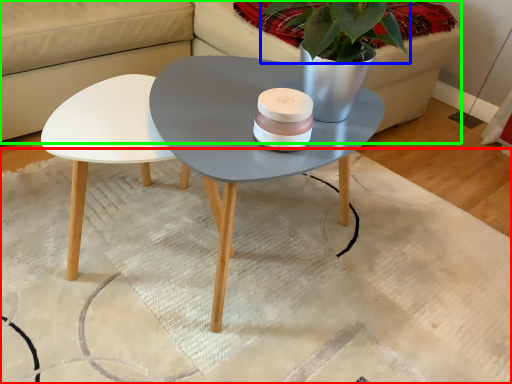
Question: Estimate the real-world distances between objects in this image. Which object is closer to mat (highlighted by a red box), plant (highlighted by a blue box) or couch (highlighted by a green box)?

Choices:
 (A) plant
 (B) couch

Answer: (B)